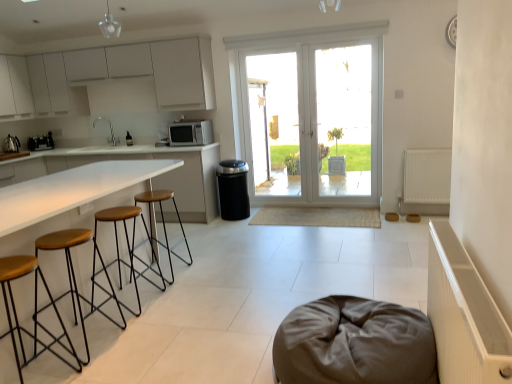
Question: From a real-world perspective, is white matte radiator at right, the 1th radiator in the back-to-front sequence, beneath white glass door at center?

Choices:
 (A) yes
 (B) no

Answer: (A)

Question: Does white matte radiator at right, marked as the 2th radiator in a front-to-back arrangement, have a lesser width compared to white glass door at center?

Choices:
 (A) yes
 (B) no

Answer: (B)

Question: Is there a large distance between white matte radiator at right, marked as the 2th radiator in a front-to-back arrangement, and white glass door at center?

Choices:
 (A) yes
 (B) no

Answer: (A)

Question: Is white matte radiator at right, the 1th radiator in the back-to-front sequence, looking in the opposite direction of white glass door at center?

Choices:
 (A) no
 (B) yes

Answer: (A)

Question: Is white matte radiator at right, which is the 1th radiator in top-to-bottom order, smaller than white glass door at center?

Choices:
 (A) no
 (B) yes

Answer: (B)

Question: In the image, is white matte countertop at center positioned in front of or behind white matte radiator at right, which is the 2th radiator from left to right?

Choices:
 (A) behind
 (B) front

Answer: (A)

Question: Considering the positions of white matte countertop at center and white matte radiator at right, which appears as the 1th radiator when viewed from the right, in the image, is white matte countertop at center bigger or smaller than white matte radiator at right, which appears as the 1th radiator when viewed from the right,?

Choices:
 (A) small
 (B) big

Answer: (B)

Question: From a real-world perspective, is white matte countertop at center positioned above or below white matte radiator at right, the second radiator when ordered from bottom to top?

Choices:
 (A) above
 (B) below

Answer: (A)

Question: In terms of width, does white matte countertop at center look wider or thinner when compared to white matte radiator at right, which is the 1th radiator in top-to-bottom order?

Choices:
 (A) wide
 (B) thin

Answer: (A)

Question: From a real-world perspective, is wooden seat with metal legs at left, the 2th stool viewed from the back, positioned above or below white ribbed radiator at right, acting as the first radiator starting from the left?

Choices:
 (A) above
 (B) below

Answer: (B)

Question: In terms of size, does wooden seat with metal legs at left, which ranks as the third stool in front-to-back order, appear bigger or smaller than white ribbed radiator at right, acting as the 2th radiator starting from the right?

Choices:
 (A) big
 (B) small

Answer: (B)

Question: Is wooden seat with metal legs at left, the 2th stool viewed from the back, wider or thinner than white ribbed radiator at right, which appears as the 1th radiator when viewed from the front?

Choices:
 (A) wide
 (B) thin

Answer: (A)

Question: From the image's perspective, is wooden seat with metal legs at left, which ranks as the third stool in front-to-back order, above or below white ribbed radiator at right, the 2th radiator positioned from the top?

Choices:
 (A) above
 (B) below

Answer: (A)

Question: In terms of size, does white ribbed radiator at right, acting as the first radiator starting from the left, appear bigger or smaller than brown wood/black metal stool at left, marked as the 2th stool in a front-to-back arrangement?

Choices:
 (A) big
 (B) small

Answer: (A)

Question: Would you say white ribbed radiator at right, which appears as the 1th radiator when viewed from the front, is to the left or to the right of brown wood/black metal stool at left, marked as the 2th stool in a front-to-back arrangement, in the picture?

Choices:
 (A) right
 (B) left

Answer: (A)